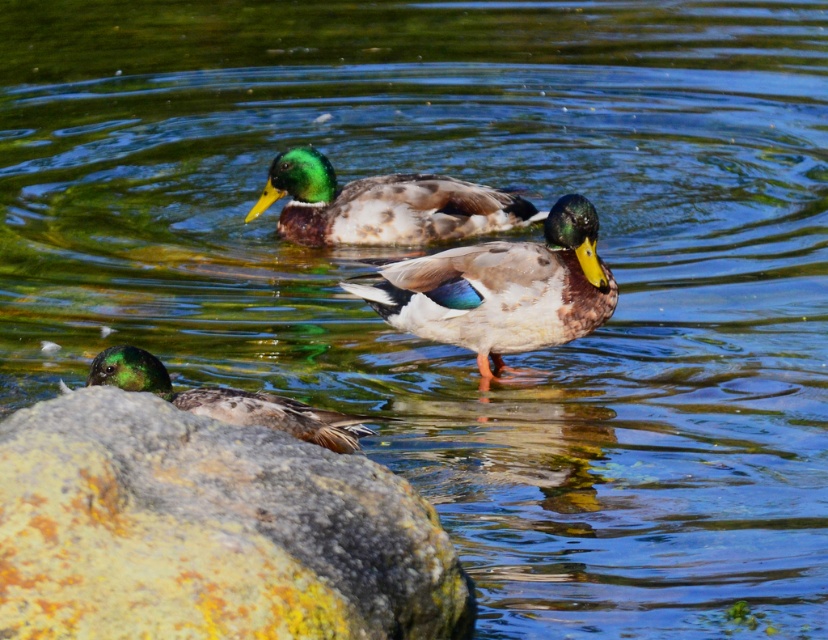
You are standing at the point marked by the coordinates point (502,289) in the image. Looking around, you see the shiny brown duck at center. What is the nearest object to you?

The nearest object to you at point (502,289) is the shiny brown duck at center since the coordinates directly indicate its location.

You are observing the scene and notice the speckled rock at lower left and the green glossy duck at lower left. Which object is closer to the viewer?

The speckled rock at lower left is positioned under the green glossy duck at lower left, so the rock is closer to the viewer than the duck.

You are a photographer trying to capture a clear photo of the green glossy duck at lower left. However, the speckled rock at lower left is blocking your view. Can you move the rock to get a better shot?

The speckled rock at lower left is in front of the green glossy duck at lower left, so moving the rock would allow you to see the duck clearly.